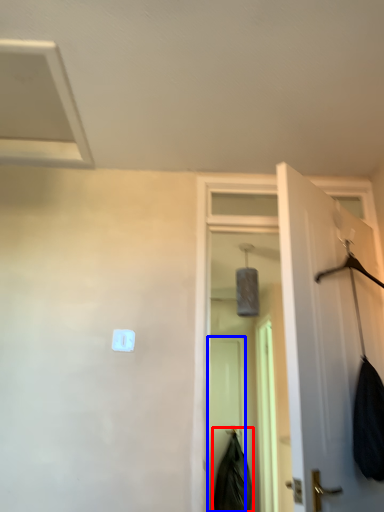
Question: Which object appears farthest to the camera in this image, clothing (highlighted by a red box) or screen door (highlighted by a blue box)?

Choices:
 (A) clothing
 (B) screen door

Answer: (B)